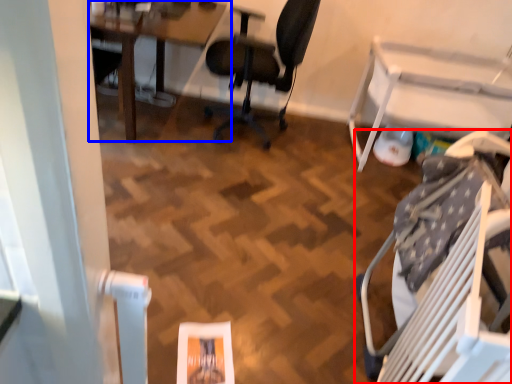
Question: Among these objects, which one is nearest to the camera, chair (highlighted by a red box) or table (highlighted by a blue box)?

Choices:
 (A) chair
 (B) table

Answer: (A)